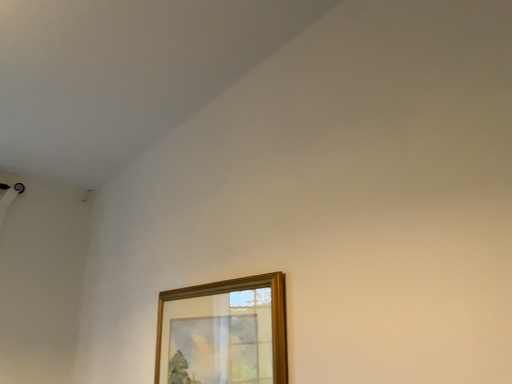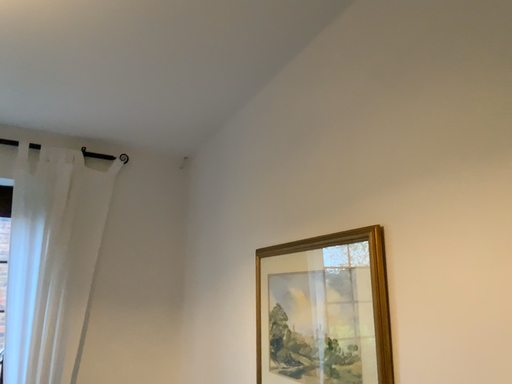
Question: Which way did the camera rotate in the video?

Choices:
 (A) rotated left
 (B) rotated right

Answer: (A)